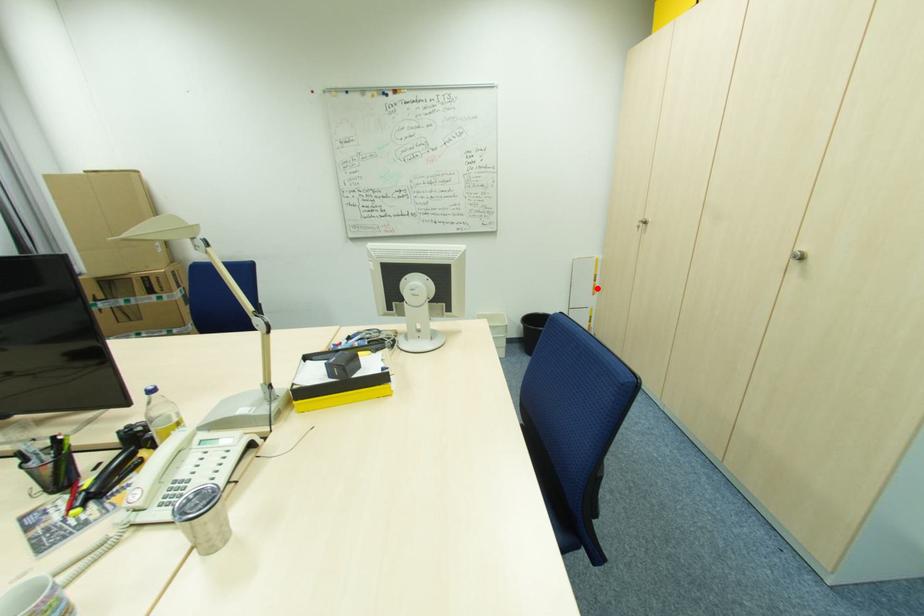
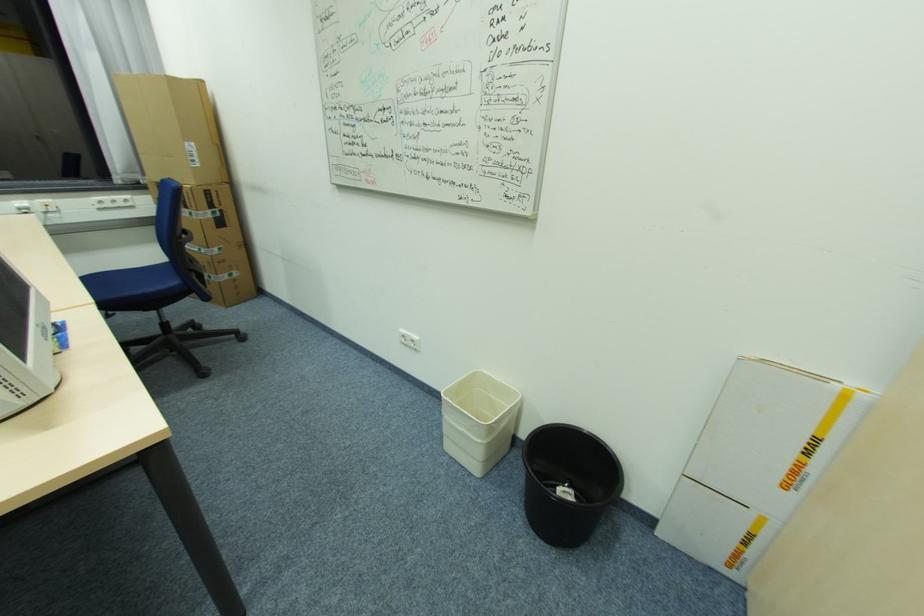
Question: A red point is marked in image1. In image2, is the corresponding 3D point closer to the camera or farther? Reply with the corresponding letter.

Choices:
 (A) The corresponding 3D point is closer.
 (B) The corresponding 3D point is farther.

Answer: (B)